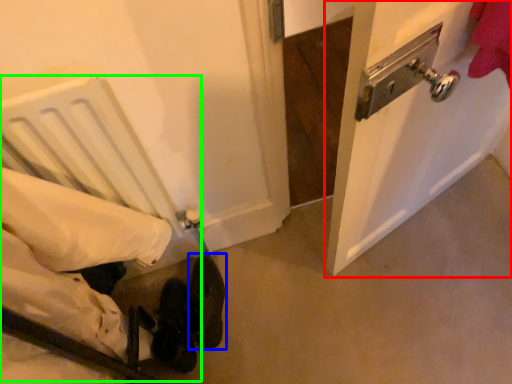
Question: Which is nearer to the door (highlighted by a red box)? footwear (highlighted by a blue box) or bed (highlighted by a green box).

Choices:
 (A) footwear
 (B) bed

Answer: (B)